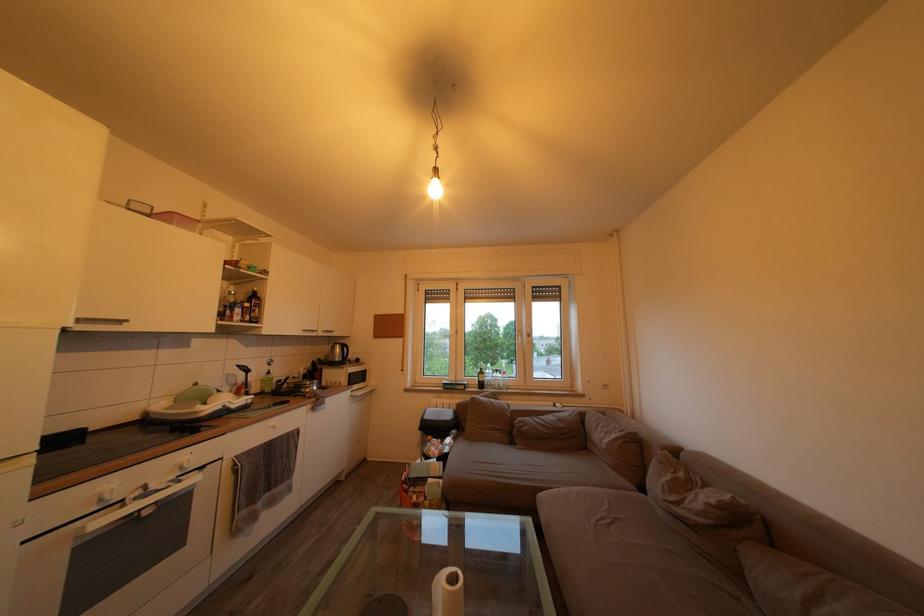
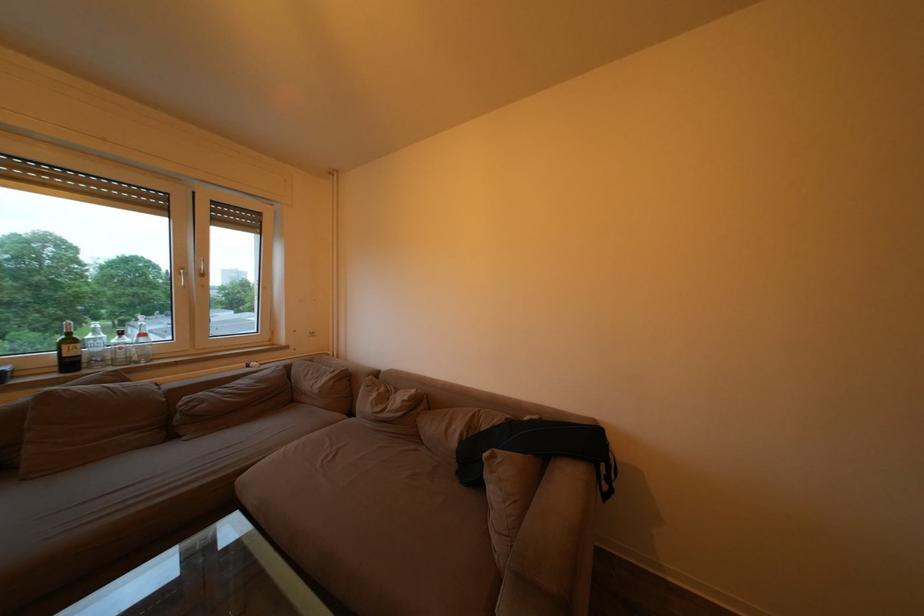
The point at (688, 480) is marked in the first image. Where is the corresponding point in the second image?

(390, 395)